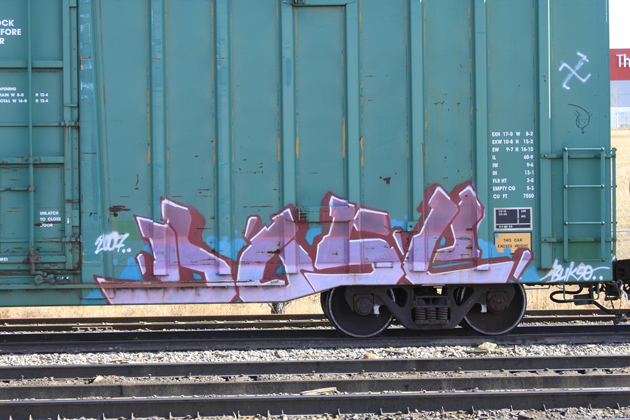
This screenshot has width=630, height=420. What are the coordinates of `rod` in the screenshot? It's located at (32, 180).